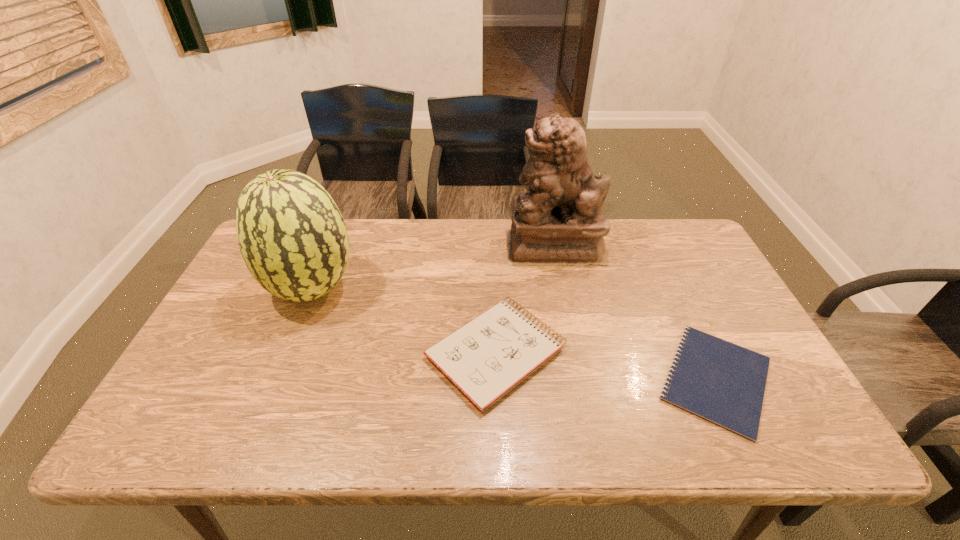
In order to click on blank area located on the right of the leftmost object in this screenshot , I will do `click(418, 289)`.

The width and height of the screenshot is (960, 540). What are the coordinates of `vacant point located on the left of the third tallest object` in the screenshot? It's located at coord(348,353).

The width and height of the screenshot is (960, 540). In order to click on free space located 0.370m on the left of the shorter notepad in this screenshot , I will do `click(497, 379)`.

The width and height of the screenshot is (960, 540). I want to click on sculpture located in the far edge section of the desktop, so click(559, 221).

The width and height of the screenshot is (960, 540). I want to click on watermelon located in the far edge section of the desktop, so click(x=293, y=239).

Locate an element on the screen. The width and height of the screenshot is (960, 540). object at the left edge is located at coordinates (293, 239).

You are a GUI agent. You are given a task and a screenshot of the screen. Output one action in this format:
    pyautogui.click(x=<x>, y=<y>)
    Task: Click on the object situated at the right edge
    The image size is (960, 540).
    Given the screenshot: What is the action you would take?
    pyautogui.click(x=724, y=383)

Image resolution: width=960 pixels, height=540 pixels. Find the location of `object that is at the far left corner`. object that is at the far left corner is located at coordinates (293, 239).

Find the location of a particular element. object that is at the near right corner is located at coordinates (724, 383).

The image size is (960, 540). Identify the location of vacant position at the far edge of the desktop. (414, 259).